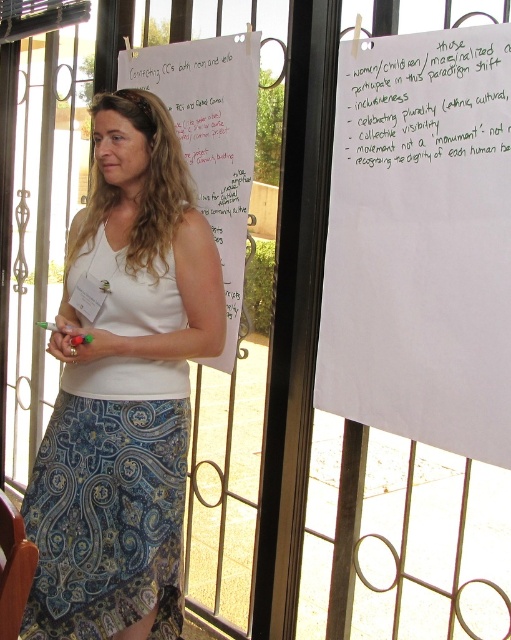
Question: Which of the following is the closest to the observer?

Choices:
 (A) white paper at upper center
 (B) white cotton tank top at center
 (C) white paper at upper right

Answer: (C)

Question: Which point is farther to the camera?

Choices:
 (A) white paper at upper right
 (B) white paper at upper center

Answer: (B)

Question: Considering the relative positions of white paper at upper center and white cotton tank top at center in the image provided, where is white paper at upper center located with respect to white cotton tank top at center?

Choices:
 (A) below
 (B) above

Answer: (B)

Question: Which point is farther to the camera?

Choices:
 (A) white paper at upper right
 (B) white cotton tank top at center

Answer: (B)

Question: Can you confirm if white paper at upper center is positioned to the right of white paper at center?

Choices:
 (A) yes
 (B) no

Answer: (A)

Question: Can you confirm if white paper at upper center is positioned to the right of white paper at center?

Choices:
 (A) no
 (B) yes

Answer: (B)